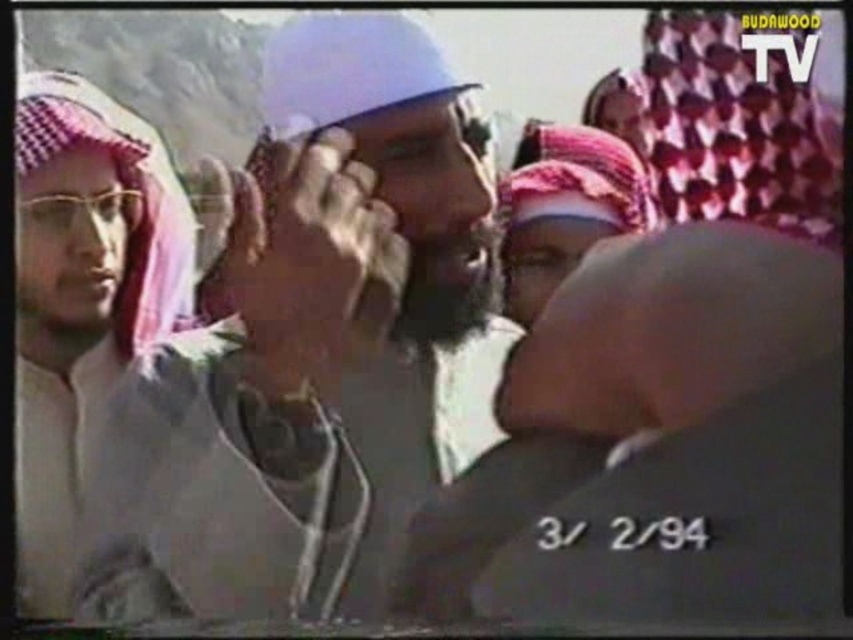
Looking at this image, can you confirm if white matte headscarf at center is smaller than white checkered headscarf at left?

Actually, white matte headscarf at center might be larger than white checkered headscarf at left.

Does white matte headscarf at center appear on the right side of white checkered headscarf at left?

Indeed, white matte headscarf at center is positioned on the right side of white checkered headscarf at left.

What do you see at coordinates (297, 356) in the screenshot?
I see `white matte headscarf at center` at bounding box center [297, 356].

Locate an element on the screen. This screenshot has height=640, width=853. white matte headscarf at center is located at coordinates (297, 356).